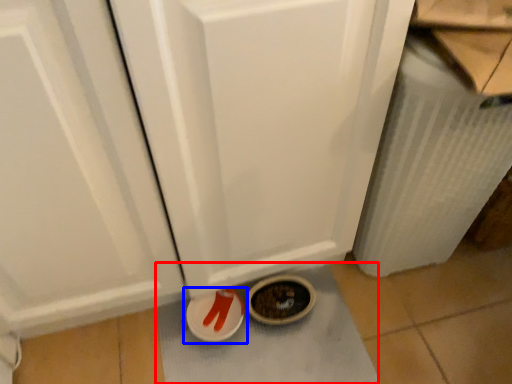
Question: Which object is closer to the camera taking this photo, bath mat (highlighted by a red box) or footwear (highlighted by a blue box)?

Choices:
 (A) bath mat
 (B) footwear

Answer: (A)